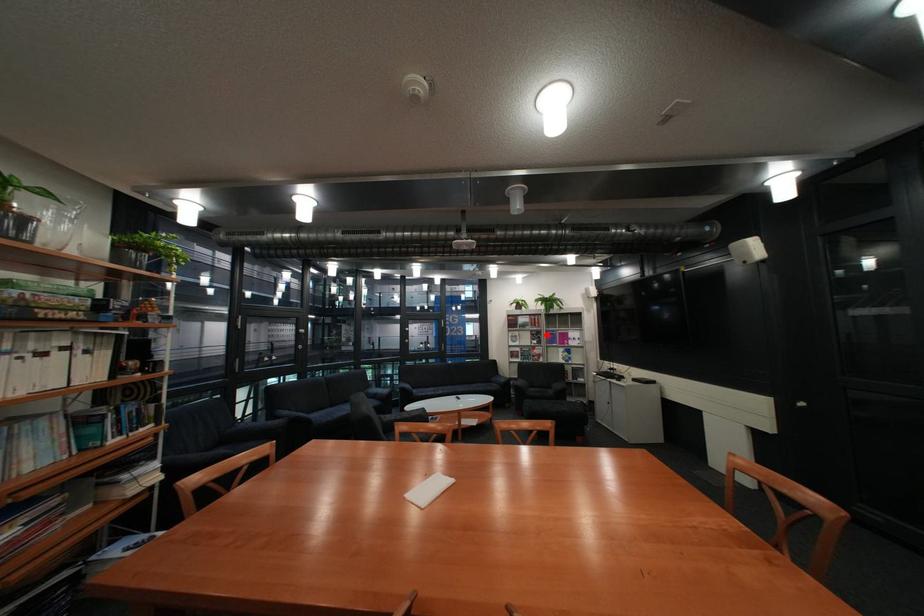
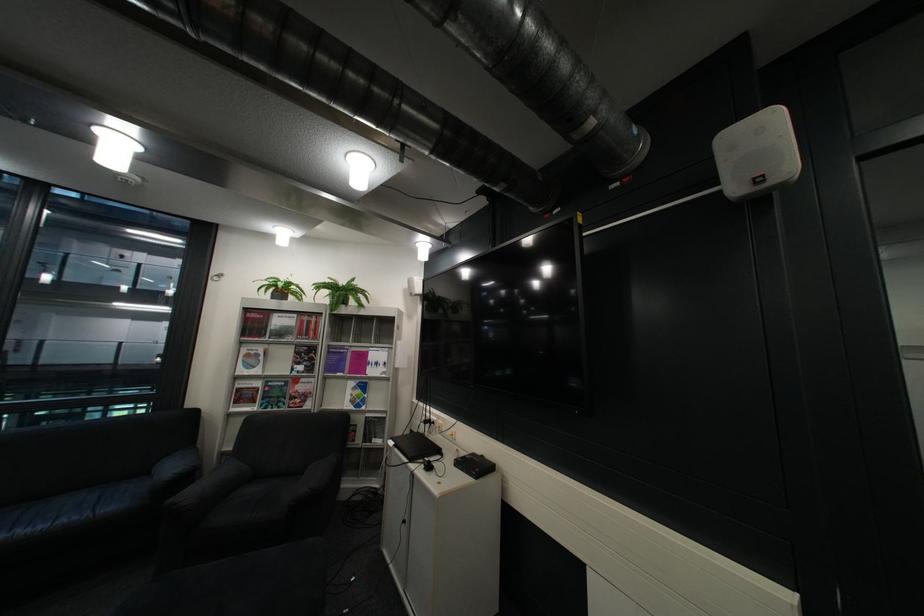
In the second image, find the point that corresponds to the highlighted location in the first image.

(311, 353)